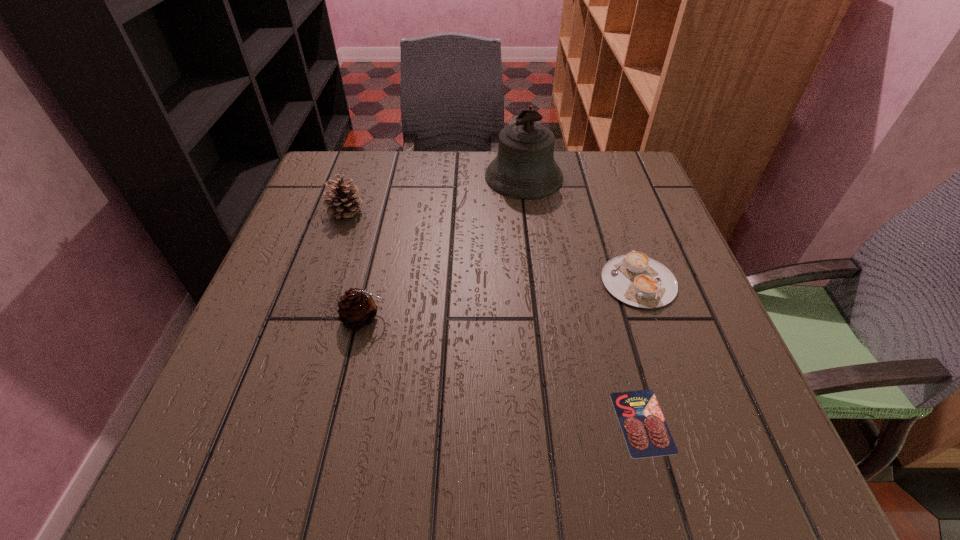
Select which object appears as the third closest to the taller pinecone. Please provide its 2D coordinates. Your answer should be formatted as a tuple, i.e. [(x, y)], where the tuple contains the x and y coordinates of a point satisfying the conditions above.

[(635, 279)]

The height and width of the screenshot is (540, 960). I want to click on free region that satisfies the following two spatial constraints: 1. on the back side of the bell; 2. on the left side of the farther pinecone, so click(357, 177).

Where is `vacant region that satisfies the following two spatial constraints: 1. on the front side of the salami; 2. on the left side of the tallest object`? Image resolution: width=960 pixels, height=540 pixels. vacant region that satisfies the following two spatial constraints: 1. on the front side of the salami; 2. on the left side of the tallest object is located at coordinates (554, 422).

What are the coordinates of `vacant area that satisfies the following two spatial constraints: 1. with a leaf charm attached to the third tallest object; 2. on the back side of the shortest object` in the screenshot? It's located at (340, 422).

You are a GUI agent. You are given a task and a screenshot of the screen. Output one action in this format:
    pyautogui.click(x=<x>, y=<y>)
    Task: Click on the blank space that satisfies the following two spatial constraints: 1. on the front side of the tallest object; 2. on the right side of the shortest object
    The height and width of the screenshot is (540, 960).
    Given the screenshot: What is the action you would take?
    pyautogui.click(x=554, y=422)

Identify the location of free region that satisfies the following two spatial constraints: 1. on the front side of the second tallest object; 2. on the right side of the cappuccino. The image size is (960, 540). (322, 281).

Where is `free space that satisfies the following two spatial constraints: 1. on the back side of the farthest object; 2. on the left side of the leftmost object`? The height and width of the screenshot is (540, 960). free space that satisfies the following two spatial constraints: 1. on the back side of the farthest object; 2. on the left side of the leftmost object is located at coordinates (357, 177).

You are a GUI agent. You are given a task and a screenshot of the screen. Output one action in this format:
    pyautogui.click(x=<x>, y=<y>)
    Task: Click on the vacant region that satisfies the following two spatial constraints: 1. on the back side of the salami; 2. with a leaf charm attached to the fourth object from right to left
    
    Given the screenshot: What is the action you would take?
    pyautogui.click(x=614, y=319)

At what (x,y) coordinates should I click in order to perform the action: click on vacant space that satisfies the following two spatial constraints: 1. on the back side of the cappuccino; 2. on the left side of the nearest object. Please return your answer as a coordinate pair (x, y). Looking at the image, I should click on (605, 281).